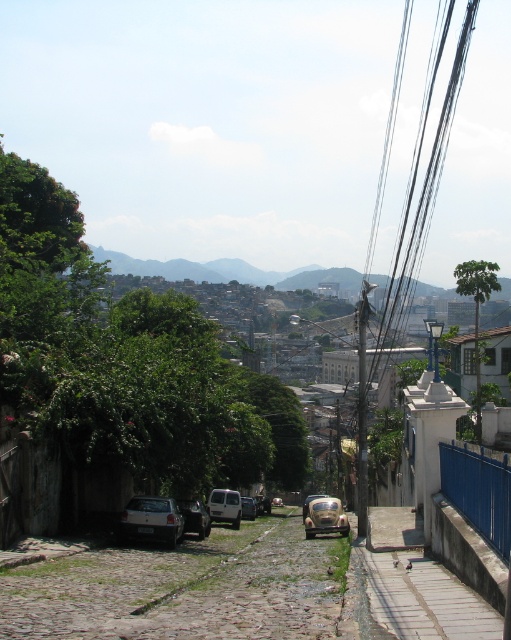
Between point (423, 209) and point (243, 508), which one is positioned behind?

The point (423, 209) is more distant.

Is point (422, 256) positioned after point (252, 499)?

Yes, point (422, 256) is behind point (252, 499).

The width and height of the screenshot is (511, 640). What are the coordinates of `black wire at upper right` in the screenshot? It's located at (424, 177).

Is black wire at upper right above metallic silver car at center?

Correct, black wire at upper right is located above metallic silver car at center.

Which is below, black wire at upper right or metallic silver car at center?

metallic silver car at center

Is point (425, 227) positioned in front of point (187, 518)?

That is False.

In order to click on black wire at upper right in this screenshot , I will do `click(424, 177)`.

Can you confirm if black wire at upper right is taller than silver metallic car at lower left?

Yes, black wire at upper right is taller than silver metallic car at lower left.

Can you confirm if black wire at upper right is shorter than silver metallic car at lower left?

No.

Is point (412, 237) closer to camera compared to point (130, 515)?

No.

You are a GUI agent. You are given a task and a screenshot of the screen. Output one action in this format:
    pyautogui.click(x=<x>, y=<y>)
    Task: Click on the black wire at upper right
    
    Given the screenshot: What is the action you would take?
    pyautogui.click(x=424, y=177)